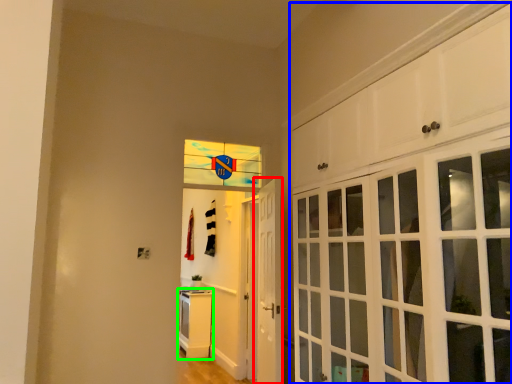
Question: Which object is the closest to the door (highlighted by a red box)? Choose among these: cabinetry (highlighted by a blue box) or cabinetry (highlighted by a green box).

Choices:
 (A) cabinetry
 (B) cabinetry

Answer: (A)